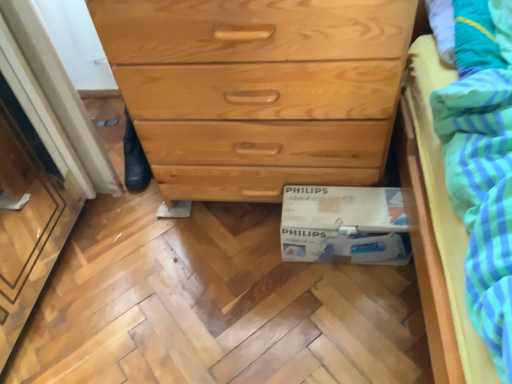
What do you see at coordinates (258, 89) in the screenshot? The width and height of the screenshot is (512, 384). I see `natural wood chest of drawers at center` at bounding box center [258, 89].

In order to face natural wood chest of drawers at center, should I rotate leftwards or rightwards?

Turn right approximately 1.108 degrees to face it.

Locate an element on the screen. This screenshot has height=384, width=512. natural wood chest of drawers at center is located at coordinates click(x=258, y=89).

This screenshot has height=384, width=512. Identify the location of white cardboard box at lower center. (344, 225).

What do you see at coordinates (344, 225) in the screenshot? This screenshot has height=384, width=512. I see `white cardboard box at lower center` at bounding box center [344, 225].

This screenshot has width=512, height=384. What are the coordinates of `natural wood chest of drawers at center` in the screenshot? It's located at (258, 89).

In the image, is natural wood chest of drawers at center on the left side or the right side of white cardboard box at lower center?

natural wood chest of drawers at center is positioned on white cardboard box at lower center's left side.

Relative to white cardboard box at lower center, is natural wood chest of drawers at center in front or behind?

Clearly, natural wood chest of drawers at center is in front of white cardboard box at lower center.

Is point (234, 7) closer to camera compared to point (341, 238)?

Yes.

From the image's perspective, between natural wood chest of drawers at center and white cardboard box at lower center, which one is located above?

natural wood chest of drawers at center.

From a real-world perspective, is natural wood chest of drawers at center over white cardboard box at lower center?

Correct, in the physical world, natural wood chest of drawers at center is higher than white cardboard box at lower center.

Is natural wood chest of drawers at center thinner than white cardboard box at lower center?

Incorrect, the width of natural wood chest of drawers at center is not less than that of white cardboard box at lower center.

From their relative heights in the image, would you say natural wood chest of drawers at center is taller or shorter than white cardboard box at lower center?

natural wood chest of drawers at center is taller than white cardboard box at lower center.

Who is smaller, natural wood chest of drawers at center or white cardboard box at lower center?

With smaller size is white cardboard box at lower center.

Is natural wood chest of drawers at center located outside white cardboard box at lower center?

Yes, natural wood chest of drawers at center is outside of white cardboard box at lower center.

Would you say natural wood chest of drawers at center is a long distance from white cardboard box at lower center?

No, there isn't a large distance between natural wood chest of drawers at center and white cardboard box at lower center.

Is natural wood chest of drawers at center looking in the opposite direction of white cardboard box at lower center?

No, natural wood chest of drawers at center is not facing the opposite direction of white cardboard box at lower center.

What's the angular difference between natural wood chest of drawers at center and white cardboard box at lower center's facing directions?

2.2 degrees.

In order to click on chest of drawers lying on the left of white cardboard box at lower center in this screenshot , I will do `click(258, 89)`.

Consider the image. Considering the positions of objects white cardboard box at lower center and natural wood chest of drawers at center in the image provided, who is more to the left, white cardboard box at lower center or natural wood chest of drawers at center?

Positioned to the left is natural wood chest of drawers at center.

Is white cardboard box at lower center positioned behind natural wood chest of drawers at center?

Yes, the depth of white cardboard box at lower center is greater than that of natural wood chest of drawers at center.

Between point (398, 202) and point (190, 7), which one is positioned in front?

Point (190, 7)

From the image's perspective, is white cardboard box at lower center located above natural wood chest of drawers at center?

Incorrect, from the image's perspective, white cardboard box at lower center is lower than natural wood chest of drawers at center.

From a real-world perspective, is white cardboard box at lower center under natural wood chest of drawers at center?

Yes, from a real-world perspective, white cardboard box at lower center is under natural wood chest of drawers at center.

Is white cardboard box at lower center thinner than natural wood chest of drawers at center?

Yes, white cardboard box at lower center is thinner than natural wood chest of drawers at center.

Considering the sizes of objects white cardboard box at lower center and natural wood chest of drawers at center in the image provided, who is shorter, white cardboard box at lower center or natural wood chest of drawers at center?

Standing shorter between the two is white cardboard box at lower center.

Is white cardboard box at lower center bigger than natural wood chest of drawers at center?

Incorrect, white cardboard box at lower center is not larger than natural wood chest of drawers at center.

Is white cardboard box at lower center completely or partially outside of natural wood chest of drawers at center?

Yes, white cardboard box at lower center is located beyond the bounds of natural wood chest of drawers at center.

Is there a large distance between white cardboard box at lower center and natural wood chest of drawers at center?

No, white cardboard box at lower center is not far from natural wood chest of drawers at center.

Consider the image. Is white cardboard box at lower center aimed at natural wood chest of drawers at center?

No, white cardboard box at lower center is not aimed at natural wood chest of drawers at center.

How different are the orientations of white cardboard box at lower center and natural wood chest of drawers at center in degrees?

They differ by 2.2 degrees in their facing directions.

You are a GUI agent. You are given a task and a screenshot of the screen. Output one action in this format:
    pyautogui.click(x=<x>, y=<y>)
    Task: Click on the chest of drawers in front of the white cardboard box at lower center
    The image size is (512, 384).
    Given the screenshot: What is the action you would take?
    pyautogui.click(x=258, y=89)

Identify the location of the chest of drawers above the white cardboard box at lower center (from a real-world perspective). This screenshot has height=384, width=512. (258, 89).

The image size is (512, 384). Find the location of `chest of drawers in front of the white cardboard box at lower center`. chest of drawers in front of the white cardboard box at lower center is located at coordinates (258, 89).